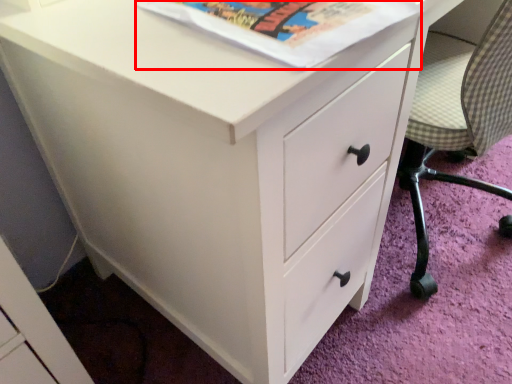
Question: From the image's perspective, where is paperback book (annotated by the red box) located relative to armchair?

Choices:
 (A) above
 (B) below

Answer: (A)